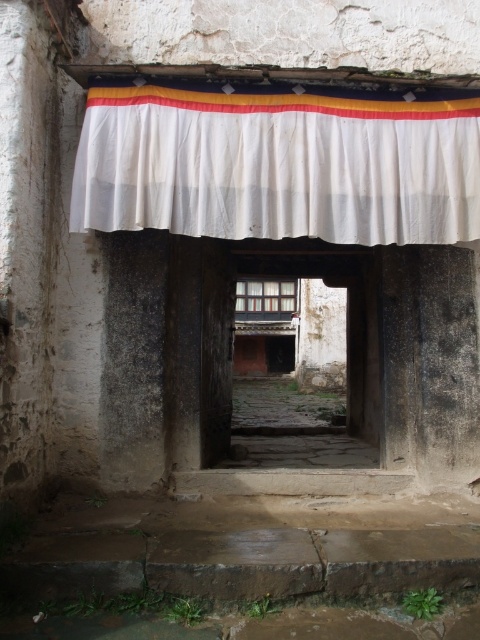
Question: Which object is closer to the camera taking this photo?

Choices:
 (A) wooden door at center
 (B) white fabric curtain at upper center

Answer: (B)

Question: Can you confirm if white fabric curtain at upper center is positioned above wooden door at center?

Choices:
 (A) yes
 (B) no

Answer: (A)

Question: In this image, where is white fabric curtain at upper center located relative to wooden door at center?

Choices:
 (A) right
 (B) left

Answer: (B)

Question: Which point is closer to the camera?

Choices:
 (A) white fabric curtain at upper center
 (B) wooden door at center

Answer: (A)

Question: Is white fabric curtain at upper center to the left of wooden door at center from the viewer's perspective?

Choices:
 (A) yes
 (B) no

Answer: (A)